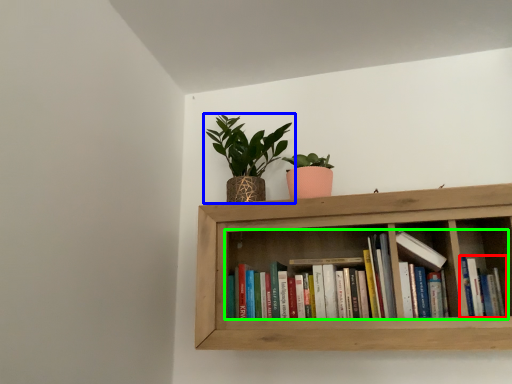
Question: Based on their relative distances, which object is farther from book (highlighted by a red box)? Choose from houseplant (highlighted by a blue box) and book (highlighted by a green box).

Choices:
 (A) houseplant
 (B) book

Answer: (A)